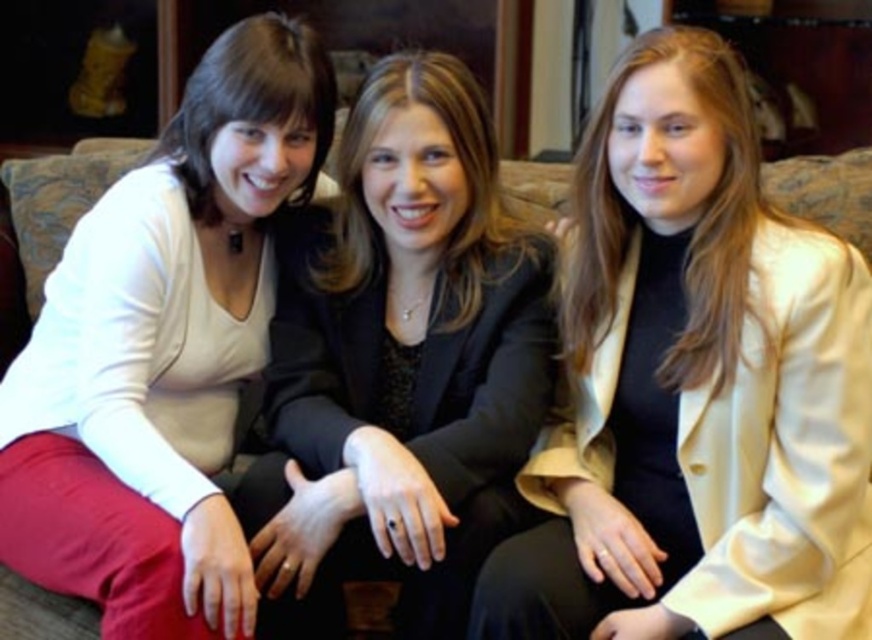
Looking at this image, you are standing in front of the couch where the three women are sitting. You notice a specific point at coordinates (693, 387). Which object from the scene does this point belong to?

The point at coordinates (693, 387) belongs to the satin beige blazer at center.

From the picture: You are a fashion designer observing the three women on the couch. You need to determine which of the two blazers, the satin beige blazer at center or the black satin blazer at center, requires more space when hanging in a wardrobe. Based on their sizes, which one would take up more space?

The satin beige blazer at center requires more space when hanging in a wardrobe because its width is larger than the black satin blazer at center.